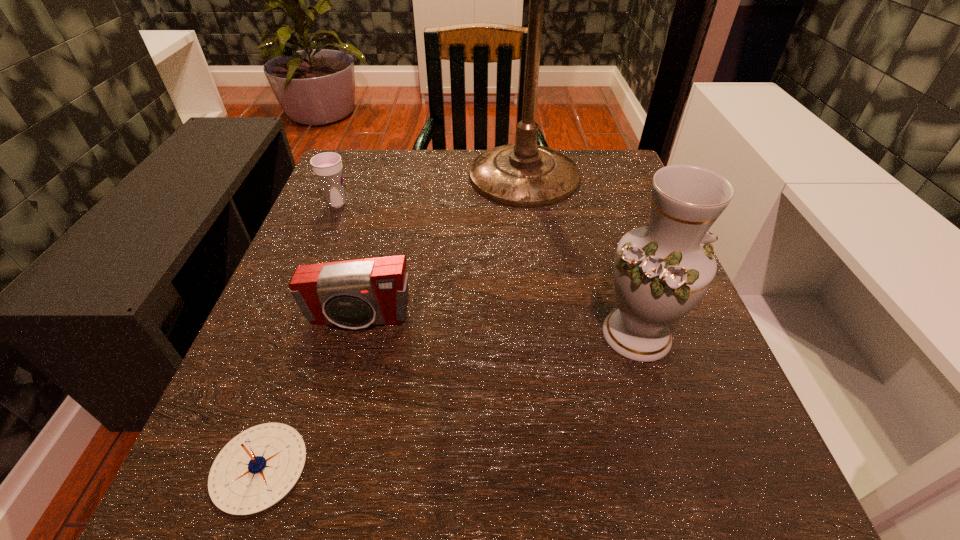
Locate an element on the screen. free region that satisfies the following two spatial constraints: 1. above the green lampshade of the table lamp; 2. on the left side of the vase is located at coordinates (545, 334).

Locate an element on the screen. blank area in the image that satisfies the following two spatial constraints: 1. above the green lampshade of the table lamp; 2. on the left side of the second tallest object is located at coordinates (545, 334).